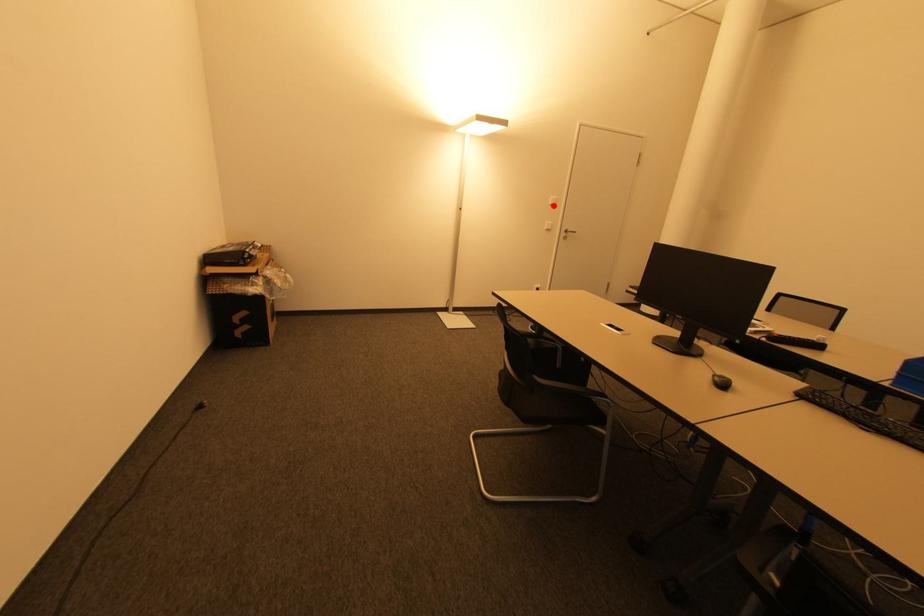
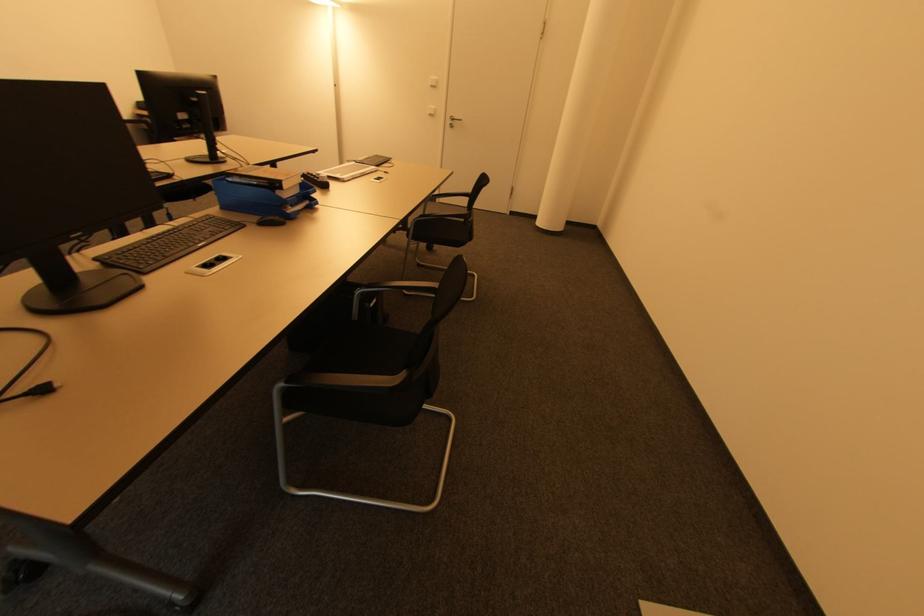
Question: I am providing you with two images of the same scene from different viewpoints. A red point is marked on the first image. Can you still see the location of the red point in image 2?

Choices:
 (A) Yes
 (B) No

Answer: (A)